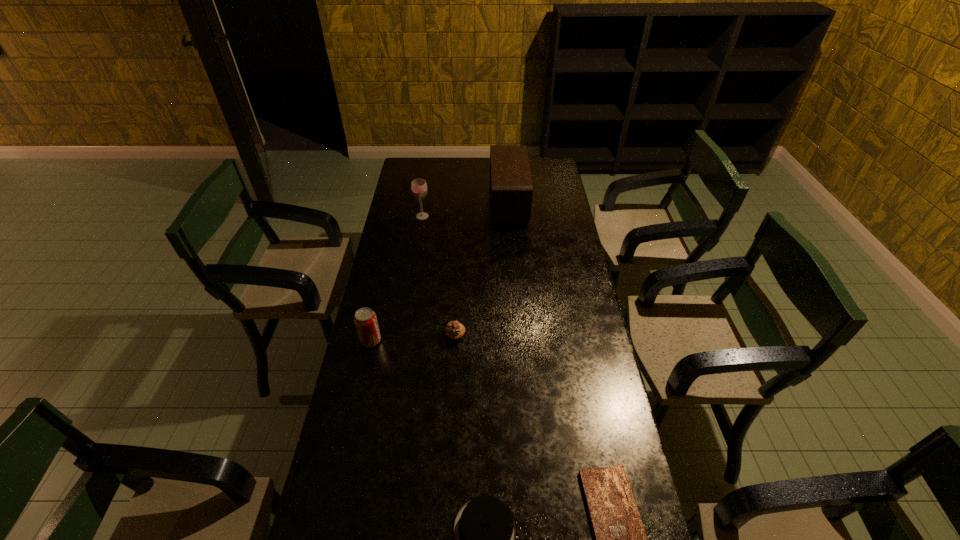
Locate an element on the screen. radio receiver is located at coordinates (511, 189).

Where is `wineglass`? This screenshot has width=960, height=540. wineglass is located at coordinates (418, 186).

Identify the location of the second object from left to right. Image resolution: width=960 pixels, height=540 pixels. (418, 186).

I want to click on the leftmost object, so click(x=365, y=319).

At what (x,y) coordinates should I click in order to perform the action: click on soda can. Please return your answer as a coordinate pair (x, y). The image size is (960, 540). Looking at the image, I should click on (365, 319).

What are the coordinates of `cupcake` in the screenshot? It's located at (454, 330).

The height and width of the screenshot is (540, 960). Identify the location of vacant space located 0.140m on the front-facing side of the radio receiver. (462, 204).

This screenshot has width=960, height=540. In order to click on vacant space located 0.180m on the front-facing side of the radio receiver in this screenshot , I will do `click(453, 204)`.

Where is `vacant space situated on the front-facing side of the radio receiver`? vacant space situated on the front-facing side of the radio receiver is located at coordinates (435, 204).

At what (x,y) coordinates should I click in order to perform the action: click on vacant area situated on the back of the second tallest object. Please return your answer as a coordinate pair (x, y). The width and height of the screenshot is (960, 540). Looking at the image, I should click on (426, 194).